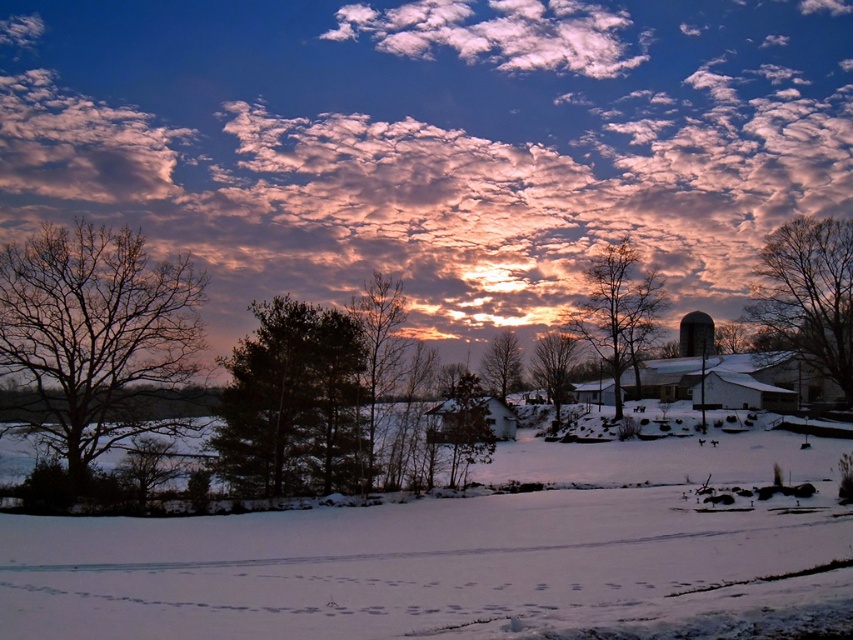
Question: Which point is farther to the camera?

Choices:
 (A) (389, 42)
 (B) (396, 362)
 (C) (469, 417)
 (D) (683, 563)

Answer: (A)

Question: Which of the following is the closest to the observer?

Choices:
 (A) dark green textured tree at center
 (B) green matte tree at center

Answer: (A)

Question: Does bare branches at left come in front of metallic silo at right?

Choices:
 (A) yes
 (B) no

Answer: (A)

Question: Can you confirm if pink cotton candy clouds at upper center is positioned to the right of bare branches at left?

Choices:
 (A) no
 (B) yes

Answer: (B)

Question: Which point is farther from the camera taking this photo?

Choices:
 (A) click(485, 401)
 (B) click(705, 355)
 (C) click(142, 252)

Answer: (B)

Question: Is bare branches at center positioned before metallic silo at right?

Choices:
 (A) yes
 (B) no

Answer: (A)